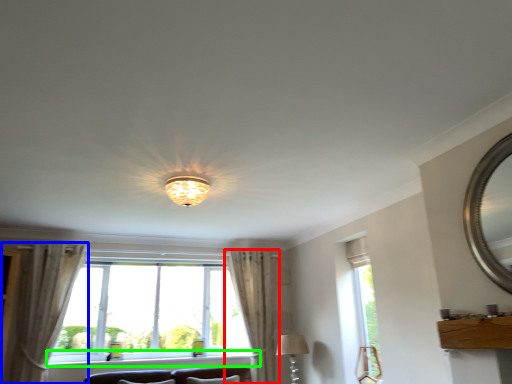
Question: Which object is positioned farthest from curtain (highlighted by a red box)? Select from curtain (highlighted by a blue box) and window sill (highlighted by a green box).

Choices:
 (A) curtain
 (B) window sill

Answer: (A)